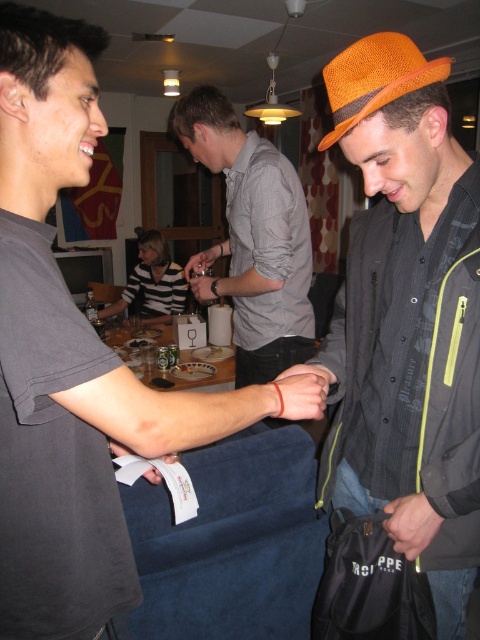
Question: Is orange woven hat at right bigger than orange straw hat at upper right?

Choices:
 (A) no
 (B) yes

Answer: (B)

Question: Does matte black shirt at upper left have a smaller size compared to orange straw hat at upper right?

Choices:
 (A) yes
 (B) no

Answer: (B)

Question: Can you confirm if orange woven hat at right is positioned below orange straw hat at upper right?

Choices:
 (A) no
 (B) yes

Answer: (B)

Question: Considering the real-world distances, which object is farthest from the orange woven hat at right?

Choices:
 (A) orange straw hat at upper right
 (B) matte black shirt at upper left
 (C) gray cotton shirt at center

Answer: (C)

Question: Which point is farther to the camera?

Choices:
 (A) (434, 323)
 (B) (376, 106)
 (C) (260, 278)

Answer: (C)

Question: Among these objects, which one is nearest to the camera?

Choices:
 (A) orange straw hat at upper right
 (B) gray cotton shirt at center
 (C) matte black shirt at upper left
 (D) orange woven hat at right

Answer: (C)